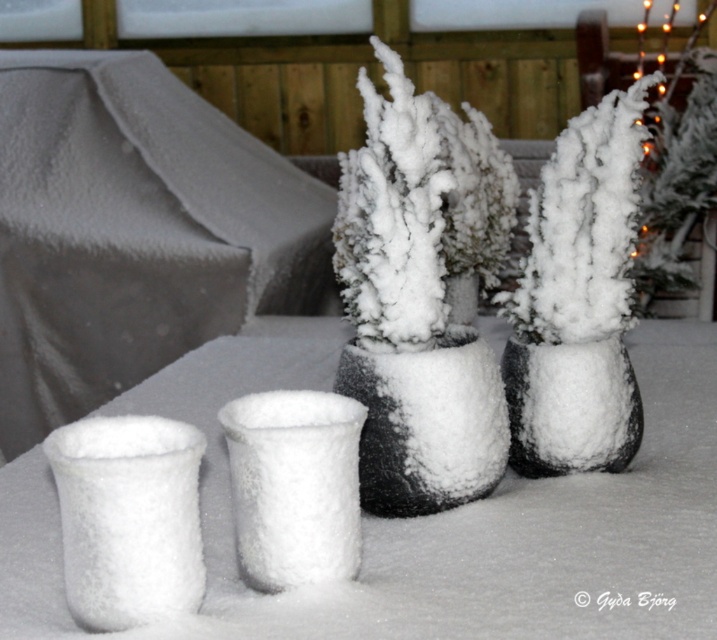
You are an interior designer arranging a winter display. You have two vases in front of you, the white fluffy vase at center and the black matte vase at center. Your client wants to place a larger decorative item on the bigger vase. Which vase should you choose?

The white fluffy vase at center is bigger than the black matte vase at center, so you should place the larger decorative item on the white fluffy vase at center.

You are planning to place a ribbon around the white fluffy vase at lower left and the frosted ceramic vase at center. Which vase will require a longer ribbon to go around its width?

The frosted ceramic vase at center requires a longer ribbon because its width is greater than the white fluffy vase at lower left.

You are standing in the winter scene and want to pick up the white fluffy vase at lower left and the frosted ceramic vase at center. Which one do you need to bend down more to reach?

You need to bend down more to reach the white fluffy vase at lower left because it is closer to the viewer and therefore lower in position compared to the frosted ceramic vase at center.